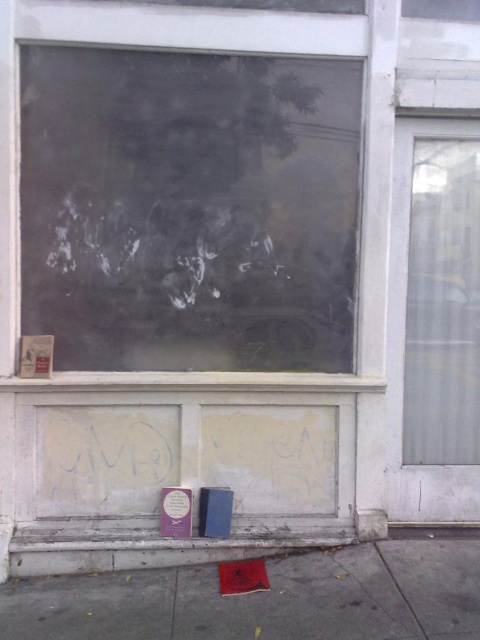
You are a delivery person trying to park your bike. The bike requires a space wider than the transparent glass window at right. Is there enough space on the smooth concrete pavement at lower center for your bike?

The smooth concrete pavement at lower center is wider than the transparent glass window at right, so there is enough space to park the bike there.

You are a window installer and need to replace the transparent glass window at right and the transparent glass window at center. Which of the two windows requires a smaller piece of glass?

The transparent glass window at right requires a smaller piece of glass because it has a smaller size compared to the transparent glass window at center.

You are standing in front of the building and want to walk to the entrance. The entrance is behind the transparent glass window at right. Can you walk directly to the entrance from your current position without stepping on the smooth concrete pavement at lower center?

The smooth concrete pavement at lower center is located below the transparent glass window at right, so the entrance is likely behind the window. Since the pavement is below the window, you would need to step on the smooth concrete pavement at lower center to reach the entrance, so you cannot avoid it.